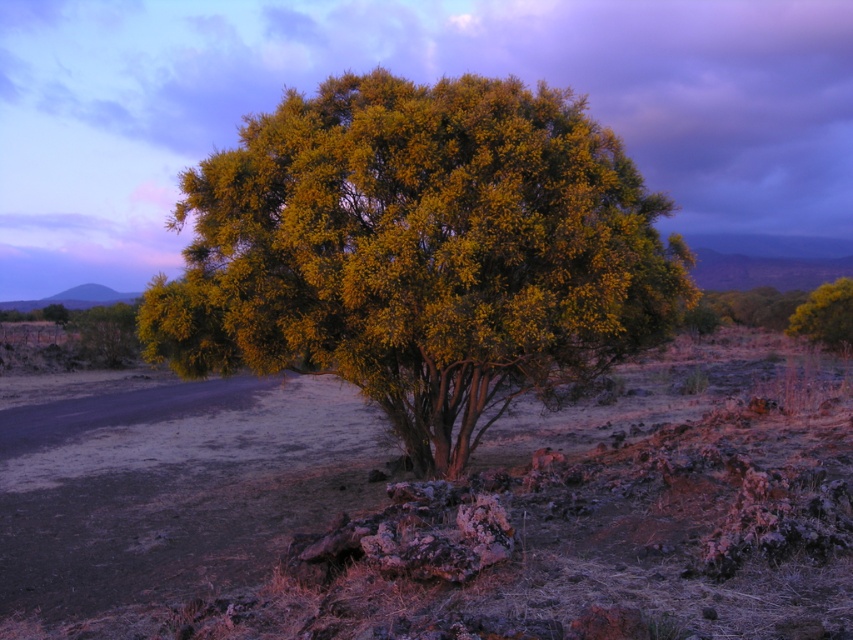
Looking at this image, is dull brown dirt at center smaller than yellow-green foliage at center?

No, dull brown dirt at center is not smaller than yellow-green foliage at center.

Who is lower down, dull brown dirt at center or yellow-green foliage at center?

dull brown dirt at center is lower down.

Does point (625, 572) lie in front of point (485, 243)?

Yes, point (625, 572) is closer to viewer.

Identify the location of dull brown dirt at center. (436, 506).

Looking at this image, is dull brown dirt at center smaller than yellow-green leafy tree at upper right?

Incorrect, dull brown dirt at center is not smaller in size than yellow-green leafy tree at upper right.

Does dull brown dirt at center come in front of yellow-green leafy tree at upper right?

Yes, it is.

Locate an element on the screen. dull brown dirt at center is located at coordinates (436, 506).

Between yellow-green foliage at center and yellow-green leafy tree at upper right, which one is positioned lower?

yellow-green foliage at center

Looking at this image, who is more distant from viewer, [360,177] or [787,333]?

The point [787,333] is behind.

Where is `yellow-green foliage at center`? This screenshot has height=640, width=853. yellow-green foliage at center is located at coordinates (419, 252).